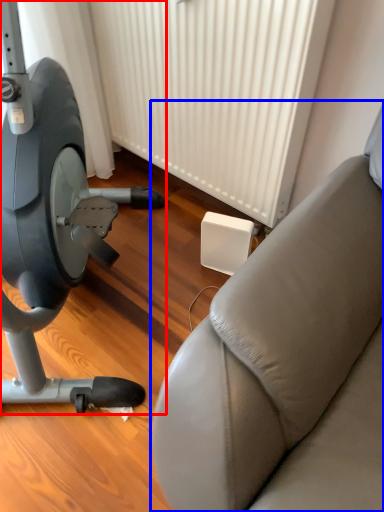
Question: Among these objects, which one is nearest to the camera, stationary bicycle (highlighted by a red box) or studio couch (highlighted by a blue box)?

Choices:
 (A) stationary bicycle
 (B) studio couch

Answer: (A)